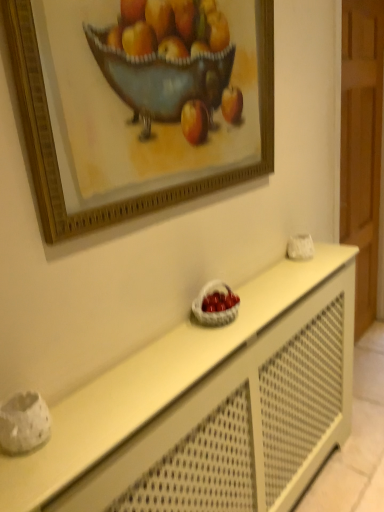
Question: From a real-world perspective, does gold wooden picture frame at upper center stand above white matte table at center?

Choices:
 (A) no
 (B) yes

Answer: (B)

Question: Does gold wooden picture frame at upper center come behind white matte table at center?

Choices:
 (A) no
 (B) yes

Answer: (A)

Question: Is gold wooden picture frame at upper center shorter than white matte table at center?

Choices:
 (A) yes
 (B) no

Answer: (A)

Question: Is white matte table at center at the back of gold wooden picture frame at upper center?

Choices:
 (A) yes
 (B) no

Answer: (B)

Question: Does gold wooden picture frame at upper center come in front of white matte table at center?

Choices:
 (A) no
 (B) yes

Answer: (B)

Question: Considering the positions of gold wooden picture frame at upper center and white woven basket at center in the image, is gold wooden picture frame at upper center taller or shorter than white woven basket at center?

Choices:
 (A) tall
 (B) short

Answer: (A)

Question: Considering the positions of point (258, 44) and point (221, 287), is point (258, 44) closer or farther from the camera than point (221, 287)?

Choices:
 (A) closer
 (B) farther

Answer: (A)

Question: From a real-world perspective, is gold wooden picture frame at upper center physically located above or below white woven basket at center?

Choices:
 (A) above
 (B) below

Answer: (A)

Question: Considering the positions of gold wooden picture frame at upper center and white woven basket at center in the image, is gold wooden picture frame at upper center bigger or smaller than white woven basket at center?

Choices:
 (A) small
 (B) big

Answer: (B)

Question: From a real-world perspective, is white matte table at center positioned above or below gold wooden picture frame at upper center?

Choices:
 (A) below
 (B) above

Answer: (A)

Question: From the image's perspective, is white matte table at center located above or below gold wooden picture frame at upper center?

Choices:
 (A) above
 (B) below

Answer: (B)

Question: Considering the positions of white matte table at center and gold wooden picture frame at upper center in the image, is white matte table at center wider or thinner than gold wooden picture frame at upper center?

Choices:
 (A) wide
 (B) thin

Answer: (A)

Question: Is white matte table at center inside the boundaries of gold wooden picture frame at upper center, or outside?

Choices:
 (A) inside
 (B) outside

Answer: (B)

Question: From a real-world perspective, is gold wooden picture frame at upper center above or below white matte table at center?

Choices:
 (A) above
 (B) below

Answer: (A)

Question: Is gold wooden picture frame at upper center spatially inside white matte table at center, or outside of it?

Choices:
 (A) outside
 (B) inside

Answer: (A)